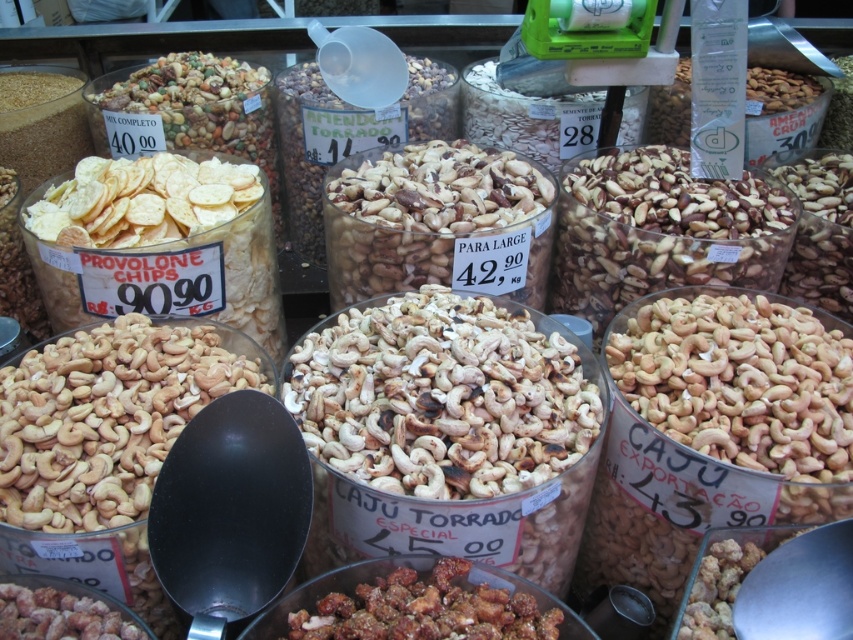
You are a customer at the market stall and want to compare the positions of the crispy brown nuts at center and the brown matte cashew nuts at lower left. Which one is located to the right of the other?

The crispy brown nuts at center is positioned on the right side of brown matte cashew nuts at lower left.